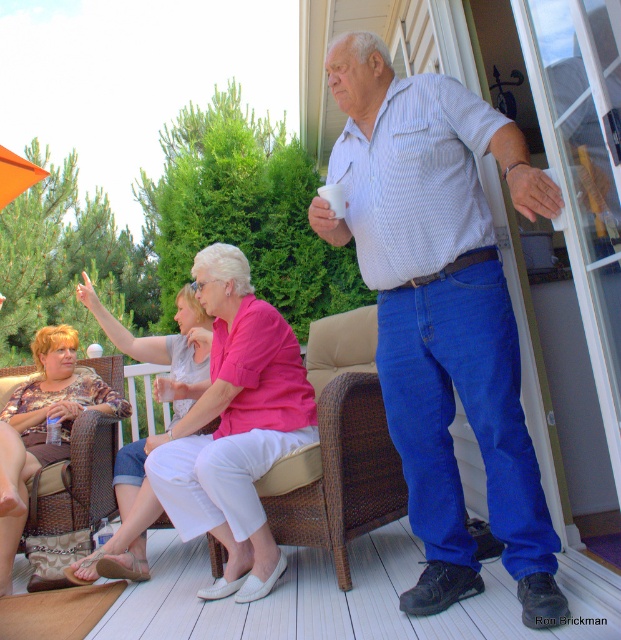
What is located at the coordinates point [233,426]?

The pink fabric shirt at center is located at point [233,426].

You are a guest at the gathering and want to sit down. The woven brown chair at center and the printed fabric dress at lower left are both in your view. Which one is shorter?

The woven brown chair at center is shorter than the printed fabric dress at lower left.